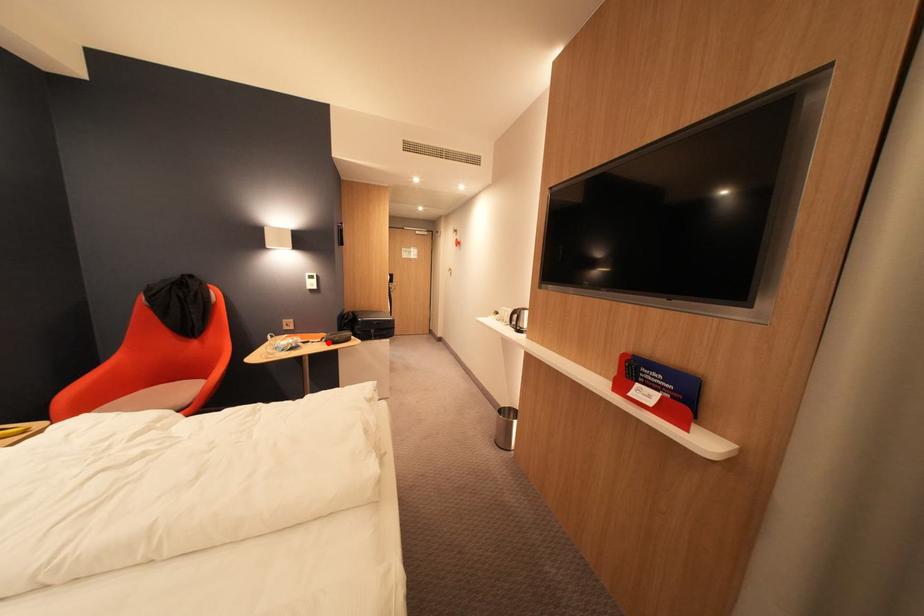
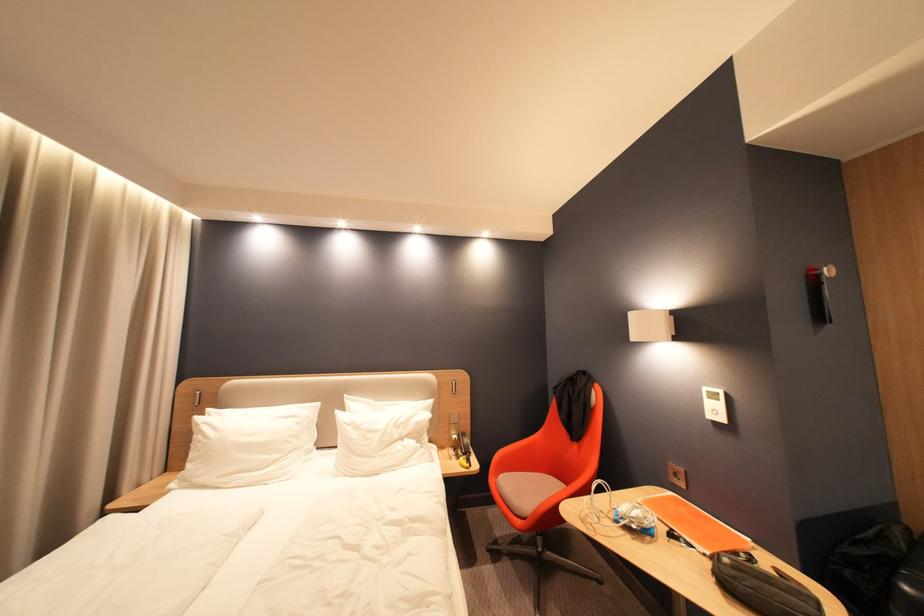
In the second image, find the point that corresponds to the highlighted location in the first image.

(714, 556)